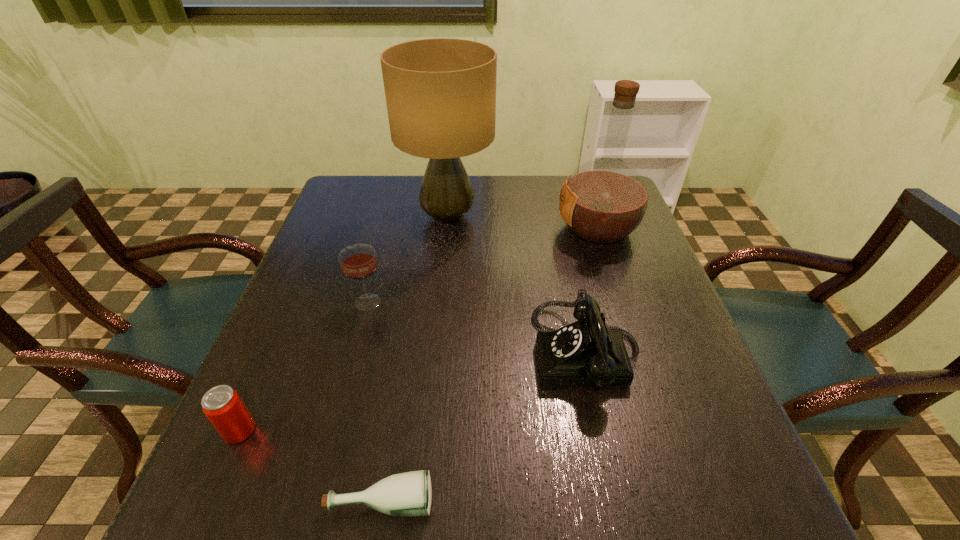
Identify the location of free space between the lampshade and the liquor. (522, 222).

Find the location of a particular element. vacant point located between the lampshade and the wineglass is located at coordinates (408, 259).

Identify which object is the second closest to the telephone. Please provide its 2D coordinates. Your answer should be formatted as a tuple, i.e. [(x, y)], where the tuple contains the x and y coordinates of a point satisfying the conditions above.

[(406, 494)]

Locate an element on the screen. This screenshot has height=540, width=960. the closest object to the liquor is located at coordinates (440, 93).

I want to click on vacant space that satisfies the following two spatial constraints: 1. on the back side of the fifth farthest object; 2. on the right side of the lampshade, so click(x=333, y=217).

In order to click on vacant space that satisfies the following two spatial constraints: 1. on the front side of the shortest object; 2. on the left side of the wineglass in this screenshot , I will do `click(316, 500)`.